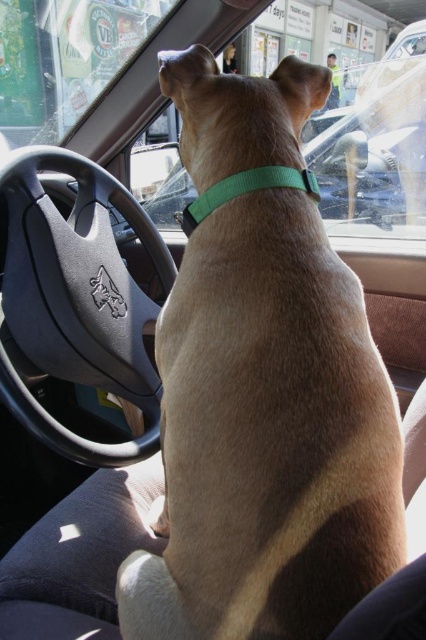
Question: Is brown matte dog at center closer to camera compared to green fabric neckband at center?

Choices:
 (A) no
 (B) yes

Answer: (B)

Question: Among these points, which one is nearest to the camera?

Choices:
 (A) (224, 188)
 (B) (229, 413)

Answer: (B)

Question: Can you confirm if brown matte dog at center is positioned below green fabric neckband at center?

Choices:
 (A) no
 (B) yes

Answer: (B)

Question: Which of the following is the closest to the observer?

Choices:
 (A) (267, 288)
 (B) (198, 211)

Answer: (A)

Question: Which point is closer to the camera?

Choices:
 (A) (227, 500)
 (B) (192, 204)

Answer: (A)

Question: Can you confirm if brown matte dog at center is positioned to the left of green fabric neckband at center?

Choices:
 (A) no
 (B) yes

Answer: (A)